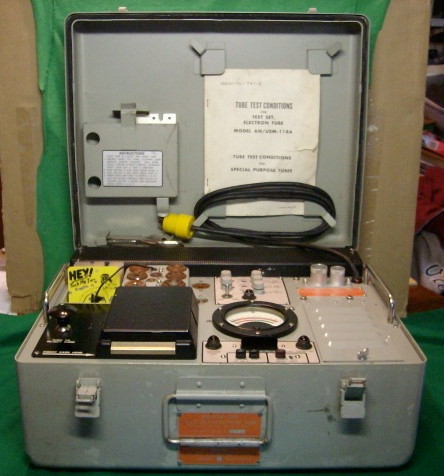
This screenshot has height=476, width=444. Identify the location of power cord. (272, 237).